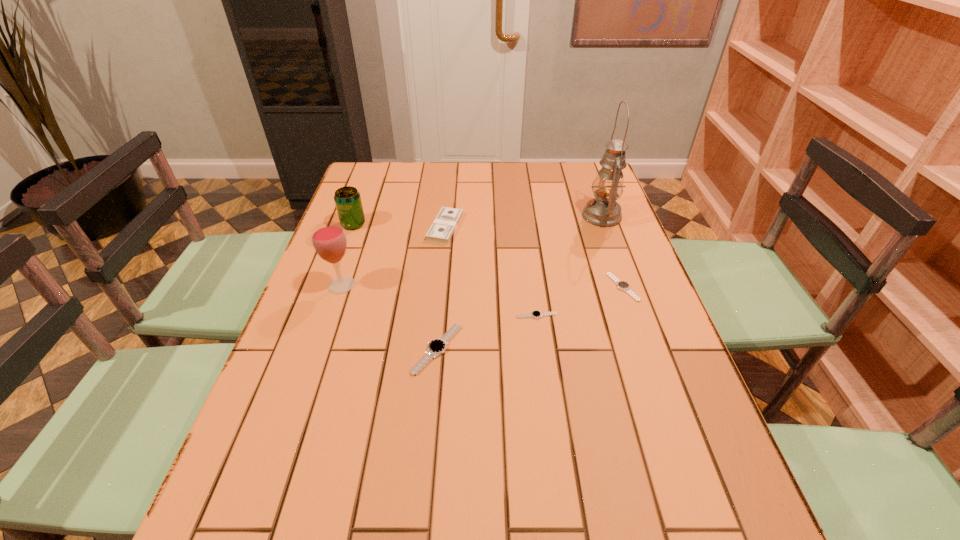
Locate an element on the screen. The image size is (960, 540). oil lamp present at the right edge is located at coordinates (603, 210).

Where is `vacant space at the far edge of the desktop`? The image size is (960, 540). vacant space at the far edge of the desktop is located at coordinates (490, 190).

At what (x,y) coordinates should I click in order to perform the action: click on vacant space at the near edge. Please return your answer as a coordinate pair (x, y). Looking at the image, I should click on (590, 459).

The width and height of the screenshot is (960, 540). What are the coordinates of `free region at the left edge of the desktop` in the screenshot? It's located at (304, 296).

Identify the location of vacant area at the right edge. The height and width of the screenshot is (540, 960). (612, 374).

Locate an element on the screen. This screenshot has width=960, height=540. vacant space at the far left corner is located at coordinates (372, 164).

Where is `vacant space at the near left corner of the desktop`? This screenshot has width=960, height=540. vacant space at the near left corner of the desktop is located at coordinates (251, 456).

Find the location of a particular element. vacant region between the nearest object and the wineglass is located at coordinates (390, 317).

Locate an element on the screen. This screenshot has height=540, width=960. unoccupied position between the tallest object and the wineglass is located at coordinates (x=471, y=251).

Locate an element on the screen. The image size is (960, 540). free area in between the second watch from right to left and the farthest watch is located at coordinates (580, 301).